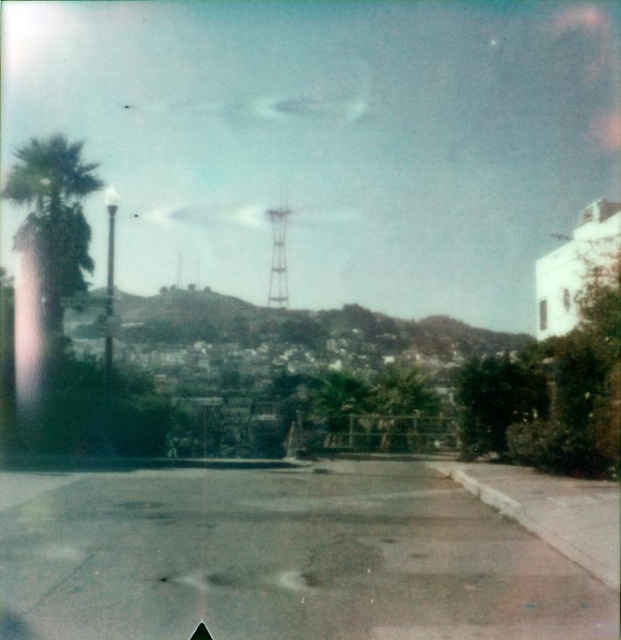
From the picture: Who is positioned more to the left, green leafy palm tree at left or metallic water tower at center?

Positioned to the left is green leafy palm tree at left.

What do you see at coordinates (53, 216) in the screenshot? The image size is (621, 640). I see `green leafy palm tree at left` at bounding box center [53, 216].

Who is more distant from viewer, (x=89, y=182) or (x=284, y=298)?

Point (x=284, y=298)

Image resolution: width=621 pixels, height=640 pixels. Identify the location of green leafy palm tree at left. (53, 216).